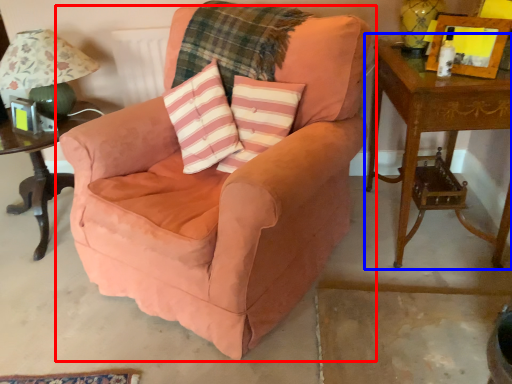
Question: Which object appears farthest to the camera in this image, chair (highlighted by a red box) or table (highlighted by a blue box)?

Choices:
 (A) chair
 (B) table

Answer: (B)